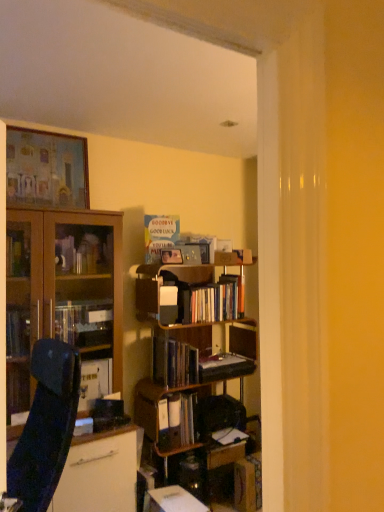
This screenshot has height=512, width=384. Describe the element at coordinates (177, 420) in the screenshot. I see `hardcover book at center, which is counted as the fourth book, starting from the top` at that location.

What do you see at coordinates (211, 300) in the screenshot? The width and height of the screenshot is (384, 512). I see `hardcover books at center, placed as the 2th book when sorted from top to bottom` at bounding box center [211, 300].

What is the approximate width of hardcover book at center, the third book from the top?

The width of hardcover book at center, the third book from the top, is 11.04 inches.

Locate an element on the screen. This screenshot has width=384, height=512. wooden bookcase at center is located at coordinates (195, 369).

The image size is (384, 512). Identify the location of hardcover book at center. (224, 367).

What are the coordinates of `white paper card at center, which is the 5th book in bottom-to-top order` in the screenshot? It's located at (159, 234).

What do you see at coordinates (159, 234) in the screenshot? I see `white paper card at center, acting as the 1th book starting from the top` at bounding box center [159, 234].

Locate an element on the screen. Image resolution: width=384 pixels, height=512 pixels. hardcover book at center, which is counted as the fourth book, starting from the top is located at coordinates (x=177, y=420).

Is white paper card at center, which is the 5th book in bottom-to-top order, beside hardcover book at center, the first book when ordered from bottom to top?

Answer: No, white paper card at center, which is the 5th book in bottom-to-top order, is not beside hardcover book at center, the first book when ordered from bottom to top.

Is white paper card at center, which is the 5th book in bottom-to-top order, behind hardcover book at center, the 5th book in the top-to-bottom sequence?

That is True.

Is hardcover book at center not close to wooden bookcase at center?

No, hardcover book at center is not far from wooden bookcase at center.

From a real-world perspective, who is located higher, hardcover book at center or wooden bookcase at center?

hardcover book at center, from a real-world perspective.

Can you tell me how much hardcover book at center and wooden bookcase at center differ in facing direction?

The angle between the facing direction of hardcover book at center and the facing direction of wooden bookcase at center is 1.12 degrees.

Is hardcover book at center to the left or to the right of wooden bookcase at center in the image?

In the image, hardcover book at center appears on the right side of wooden bookcase at center.

Considering the positions of point (235, 356) and point (260, 453), is point (235, 356) closer or farther from the camera than point (260, 453)?

Point (235, 356) is positioned farther from the camera compared to point (260, 453).

How many degrees apart are the facing directions of hardcover book at center and hardcover book at center, the 5th book in the top-to-bottom sequence?

5.49 degrees separate the facing orientations of hardcover book at center and hardcover book at center, the 5th book in the top-to-bottom sequence.

I want to click on paperback book located on the left of hardcover book at center, the 5th book in the top-to-bottom sequence, so click(224, 367).

Is hardcover book at center shorter than hardcover book at center, the 5th book in the top-to-bottom sequence?

Indeed, hardcover book at center has a lesser height compared to hardcover book at center, the 5th book in the top-to-bottom sequence.

Locate an element on the screen. Image resolution: width=384 pixels, height=512 pixels. cabinetry on the left side of hardcover book at center, the 5th book in the top-to-bottom sequence is located at coordinates (64, 296).

Would you say hardcover book at center, the 5th book in the top-to-bottom sequence, is inside or outside wooden cabinet at left?

hardcover book at center, the 5th book in the top-to-bottom sequence, is outside wooden cabinet at left.

Which object is thinner, hardcover book at center, the first book when ordered from bottom to top, or wooden cabinet at left?

With smaller width is hardcover book at center, the first book when ordered from bottom to top.

From the image's perspective, who appears lower, hardcover book at center, placed as the 3th book when sorted from bottom to top, or white paper card at center, acting as the 1th book starting from the top?

hardcover book at center, placed as the 3th book when sorted from bottom to top, from the image's perspective.

Which object is closer to the camera, hardcover book at center, placed as the 3th book when sorted from bottom to top, or white paper card at center, which is the 5th book in bottom-to-top order?

hardcover book at center, placed as the 3th book when sorted from bottom to top.

Could you tell me if hardcover book at center, the third book from the top, is turned towards white paper card at center, which is the 5th book in bottom-to-top order?

No, hardcover book at center, the third book from the top, is not aimed at white paper card at center, which is the 5th book in bottom-to-top order.

Does hardcover books at center, which ranks as the fourth book in bottom-to-top order, touch wooden cabinet at left?

They are not placed beside each other.

From the wooden cabinet at left, count 2nd books backward and point to it. Please provide its 2D coordinates.

[(211, 300)]

Is hardcover books at center, which ranks as the fourth book in bottom-to-top order, turned away from wooden cabinet at left?

That's not correct — hardcover books at center, which ranks as the fourth book in bottom-to-top order, is not looking away from wooden cabinet at left.

What's the angular difference between hardcover books at center, placed as the 2th book when sorted from top to bottom, and wooden cabinet at left's facing directions?

The angle between the facing direction of hardcover books at center, placed as the 2th book when sorted from top to bottom, and the facing direction of wooden cabinet at left is 1.04 degrees.

Which is correct: hardcover book at center is inside hardcover book at center, which is counted as the fourth book, starting from the top, or outside of it?

hardcover book at center is located beyond the bounds of hardcover book at center, which is counted as the fourth book, starting from the top.

From a real-world perspective, which object stands above the other?

hardcover book at center.

Is hardcover book at center facing away from hardcover book at center, the second book from the bottom?

That's not correct — hardcover book at center is not looking away from hardcover book at center, the second book from the bottom.

This screenshot has height=512, width=384. What are the coordinates of `the 4th book below the white paper card at center, which is the 5th book in bottom-to-top order (from the image's perspective)` in the screenshot? It's located at (248, 483).

Identify the location of paperback book on the right of wooden bookcase at center. (224, 367).

Estimate the real-world distances between objects in this image. Which object is closer to hardcover book at center, hardcover book at center, the third book from the top, or hardcover book at center, which is counted as the fourth book, starting from the top?

hardcover book at center, the third book from the top, is positioned closer to the anchor hardcover book at center.

Looking at this image, when comparing their distances from wooden cabinet at left, does hardcover book at center or matte wooden picture frame at upper left seem closer?

matte wooden picture frame at upper left is closer to wooden cabinet at left.

Which object lies nearer to the anchor point hardcover book at center, placed as the 3th book when sorted from bottom to top, hardcover books at center, placed as the 2th book when sorted from top to bottom, or wooden cabinet at left?

Among the two, hardcover books at center, placed as the 2th book when sorted from top to bottom, is located nearer to hardcover book at center, placed as the 3th book when sorted from bottom to top.

Estimate the real-world distances between objects in this image. Which object is closer to matte wooden picture frame at upper left, hardcover book at center, the second book from the bottom, or wooden cabinet at left?

Among the two, wooden cabinet at left is located nearer to matte wooden picture frame at upper left.

Which object lies further to the anchor point white paper card at center, acting as the 1th book starting from the top, wooden cabinet at left or hardcover book at center, the second book from the bottom?

hardcover book at center, the second book from the bottom.

When comparing their distances from matte wooden picture frame at upper left, does hardcover books at center, which ranks as the fourth book in bottom-to-top order, or wooden cabinet at left seem further?

The object further to matte wooden picture frame at upper left is hardcover books at center, which ranks as the fourth book in bottom-to-top order.

Based on their spatial positions, is hardcover book at center, placed as the 3th book when sorted from bottom to top, or hardcover book at center, the 5th book in the top-to-bottom sequence, closer to wooden cabinet at left?

hardcover book at center, placed as the 3th book when sorted from bottom to top.

Which object lies further to the anchor point white paper card at center, which is the 5th book in bottom-to-top order, hardcover books at center, which ranks as the fourth book in bottom-to-top order, or hardcover book at center?

The object further to white paper card at center, which is the 5th book in bottom-to-top order, is hardcover book at center.

Where is `bookcase between matte wooden picture frame at upper left and hardcover book at center, the 5th book in the top-to-bottom sequence, vertically`? This screenshot has height=512, width=384. bookcase between matte wooden picture frame at upper left and hardcover book at center, the 5th book in the top-to-bottom sequence, vertically is located at coordinates (195, 369).

Identify the location of book between wooden cabinet at left and hardcover books at center, which ranks as the fourth book in bottom-to-top order, from front to back. The image size is (384, 512). (174, 362).

The height and width of the screenshot is (512, 384). Identify the location of cabinetry that lies between matte wooden picture frame at upper left and wooden bookcase at center from top to bottom. (64, 296).

Locate an element on the screen. This screenshot has height=512, width=384. bookcase located between hardcover book at center, placed as the 3th book when sorted from bottom to top, and hardcover book at center in the left-right direction is located at coordinates (195, 369).